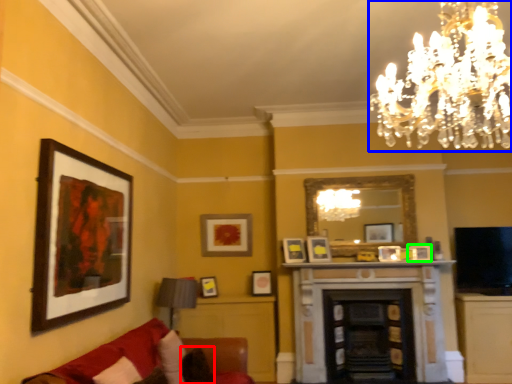
Question: Considering the real-world distances, which object is farthest from pillow (highlighted by a red box)? chandelier (highlighted by a blue box) or picture frame (highlighted by a green box)?

Choices:
 (A) chandelier
 (B) picture frame

Answer: (A)